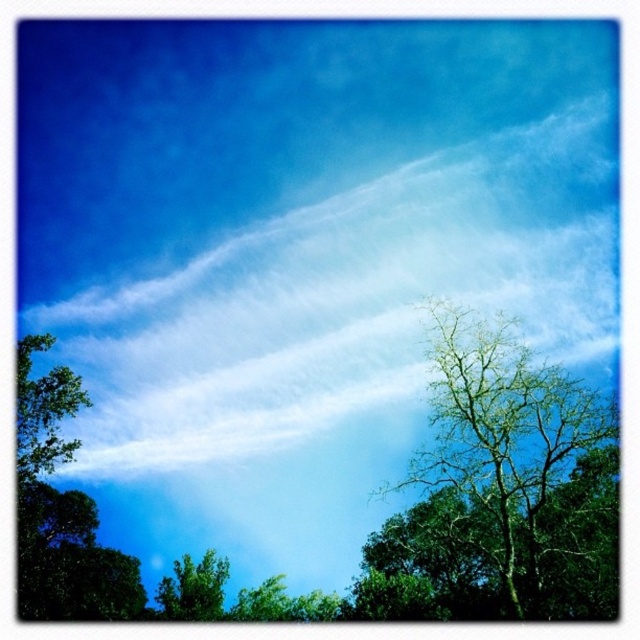
Question: Which is nearer to the green leafy tree at center?

Choices:
 (A) white cotton cloud at upper center
 (B) green leafy tree at lower center

Answer: (A)

Question: Based on their relative distances, which object is farther from the green leafy tree at center?

Choices:
 (A) green leafy tree at lower center
 (B) white cotton cloud at upper center
 (C) green leafy tree at left

Answer: (C)

Question: Is green leafy tree at center further to the viewer compared to green leafy tree at lower center?

Choices:
 (A) yes
 (B) no

Answer: (B)

Question: Which object is positioned farthest from the green leafy tree at lower center?

Choices:
 (A) green leafy tree at left
 (B) white cotton cloud at upper center
 (C) green leafy tree at center

Answer: (C)

Question: Can you confirm if green leafy tree at center is positioned to the right of green leafy tree at lower center?

Choices:
 (A) no
 (B) yes

Answer: (B)

Question: Does green leafy tree at center have a lesser width compared to green leafy tree at lower center?

Choices:
 (A) no
 (B) yes

Answer: (A)